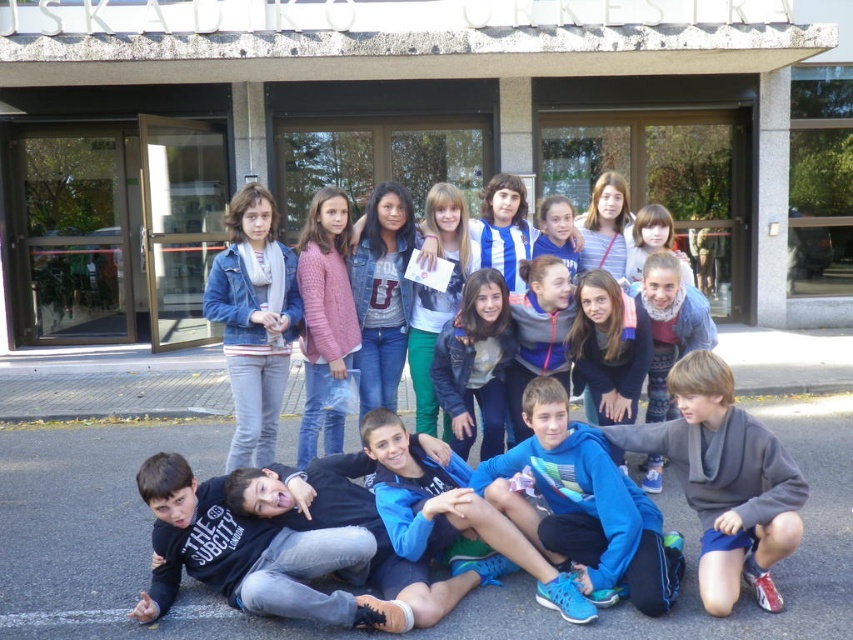
Question: Does gray fleece jacket at lower right appear on the right side of denim jacket at center?

Choices:
 (A) yes
 (B) no

Answer: (A)

Question: Which object is farther from the camera taking this photo?

Choices:
 (A) gray fleece jacket at lower right
 (B) denim jacket at center

Answer: (B)

Question: Is gray fleece jacket at lower right wider than denim jacket at center?

Choices:
 (A) yes
 (B) no

Answer: (A)

Question: Which object is closer to the camera taking this photo?

Choices:
 (A) denim jacket at center
 (B) gray fleece jacket at lower right

Answer: (B)

Question: Is gray fleece jacket at lower right below denim jacket at center?

Choices:
 (A) no
 (B) yes

Answer: (B)